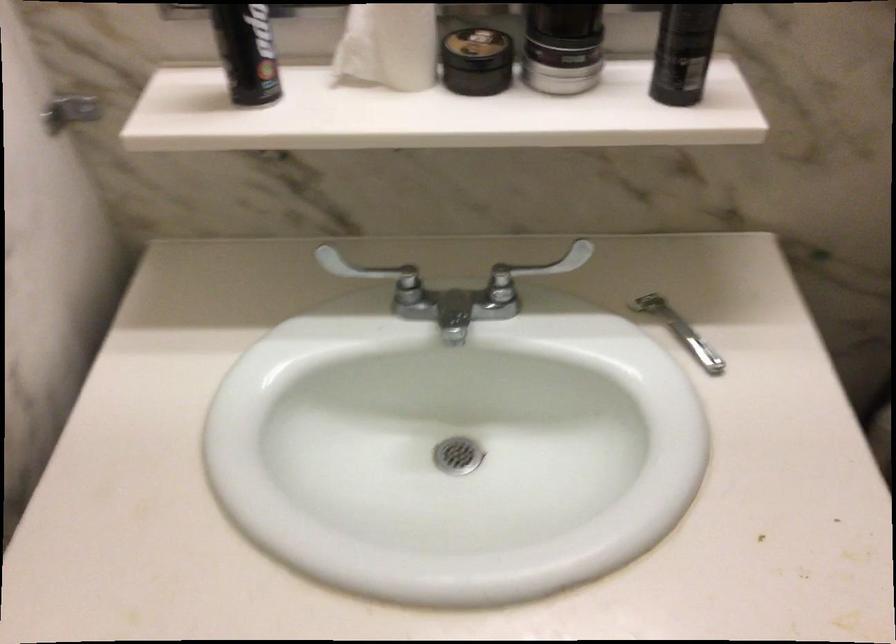
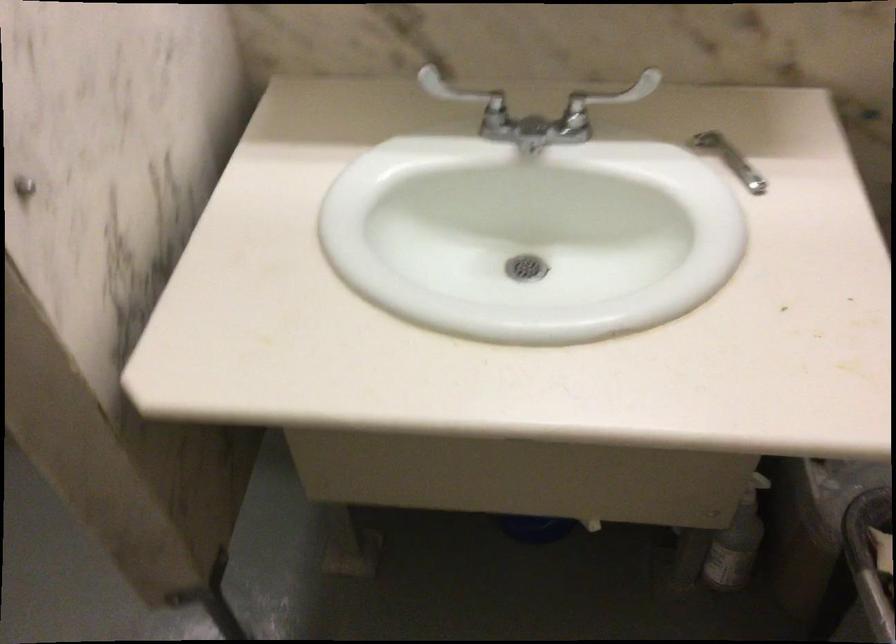
Where in the second image is the point corresponding to [377,257] from the first image?

(464, 96)